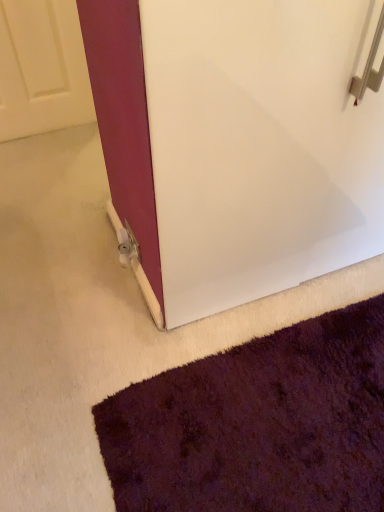
Describe the element at coordinates (257, 424) in the screenshot. I see `shaggy purple rug at lower right` at that location.

Locate an element on the screen. shaggy purple rug at lower right is located at coordinates (257, 424).

At what (x,y) coordinates should I click in order to perform the action: click on shaggy purple rug at lower right. Please return your answer as a coordinate pair (x, y). The height and width of the screenshot is (512, 384). Looking at the image, I should click on (257, 424).